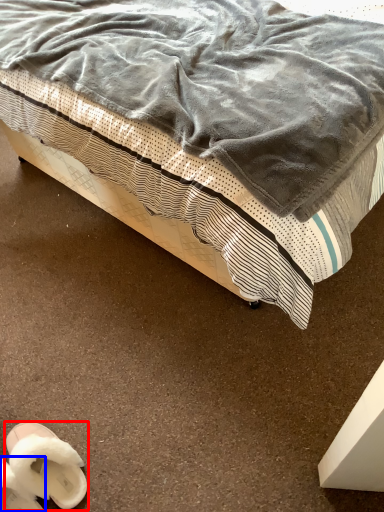
Question: Which point is further to the camera, footwear (highlighted by a red box) or footwear (highlighted by a blue box)?

Choices:
 (A) footwear
 (B) footwear

Answer: (A)